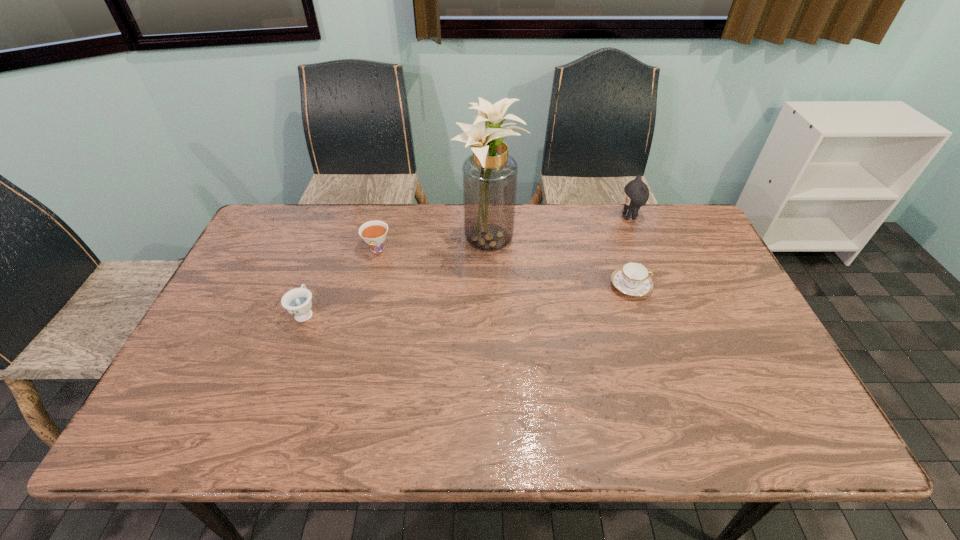
What are the coordinates of `free space at the far edge of the desktop` in the screenshot? It's located at (369, 208).

Find the location of a particular element. This screenshot has width=960, height=540. vacant point at the near edge is located at coordinates (239, 410).

At what (x,y) coordinates should I click in order to perform the action: click on free space at the right edge. Please return your answer as a coordinate pair (x, y). This screenshot has height=540, width=960. Looking at the image, I should click on (736, 334).

You are a GUI agent. You are given a task and a screenshot of the screen. Output one action in this format:
    pyautogui.click(x=<x>, y=<y>)
    Task: Click on the free space at the far left corner
    The height and width of the screenshot is (540, 960).
    Given the screenshot: What is the action you would take?
    pyautogui.click(x=304, y=215)

I want to click on free space at the far right corner of the desktop, so click(651, 210).

You are a GUI agent. You are given a task and a screenshot of the screen. Output one action in this format:
    pyautogui.click(x=<x>, y=<y>)
    Task: Click on the empty space between the farthest teacup and the shortest teacup
    
    Given the screenshot: What is the action you would take?
    pyautogui.click(x=504, y=268)

The height and width of the screenshot is (540, 960). I want to click on blank region between the leftmost object and the kitten, so click(468, 265).

At what (x,y) coordinates should I click in order to perform the action: click on empty space between the flower arrangement and the leftmost object. Please return your answer as a coordinate pair (x, y). The image size is (960, 540). Looking at the image, I should click on (397, 277).

Where is `unoccupied area between the leftmost object and the flower arrangement`? The width and height of the screenshot is (960, 540). unoccupied area between the leftmost object and the flower arrangement is located at coordinates (397, 277).

I want to click on blank region between the third object from left to right and the second tallest object, so click(x=560, y=230).